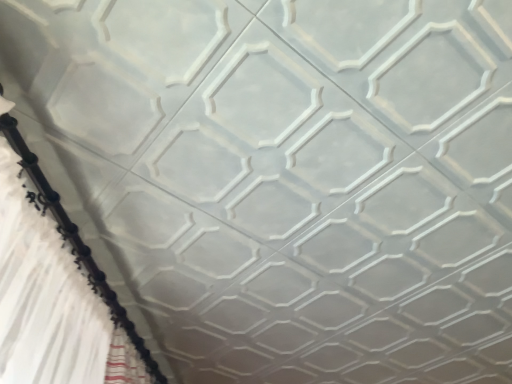
What are the coordinates of `white sheer curtain at left` in the screenshot? It's located at (51, 302).

What do you see at coordinates (51, 302) in the screenshot?
I see `white sheer curtain at left` at bounding box center [51, 302].

Image resolution: width=512 pixels, height=384 pixels. What are the coordinates of `white sheer curtain at left` in the screenshot? It's located at (51, 302).